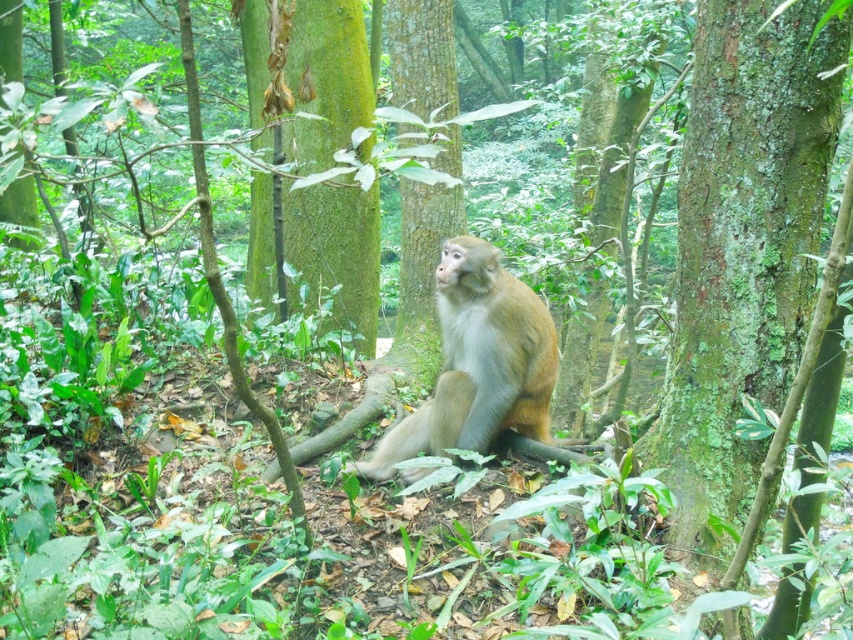
Question: Is the position of green mossy tree trunk at center less distant than that of green rough bark tree at center?

Choices:
 (A) yes
 (B) no

Answer: (B)

Question: Is green mossy tree trunk at center positioned before green rough bark tree at center?

Choices:
 (A) yes
 (B) no

Answer: (B)

Question: Which of the following is the farthest from the observer?

Choices:
 (A) green mossy tree trunk at center
 (B) green mossy bark tree at center

Answer: (A)

Question: Is green mossy bark tree at center positioned in front of golden fur monkey at center?

Choices:
 (A) no
 (B) yes

Answer: (B)

Question: Among these objects, which one is nearest to the camera?

Choices:
 (A) green mossy tree trunk at center
 (B) green mossy bark tree at center
 (C) green rough bark tree at center
 (D) golden fur monkey at center

Answer: (B)

Question: Which point appears closest to the camera in this image?

Choices:
 (A) (697, 474)
 (B) (300, 108)
 (C) (531, 301)
 (D) (410, 252)

Answer: (A)